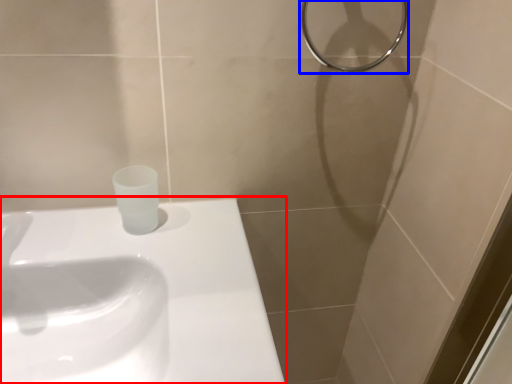
Question: Which object appears closest to the camera in this image, sink (highlighted by a red box) or shower (highlighted by a blue box)?

Choices:
 (A) sink
 (B) shower

Answer: (A)